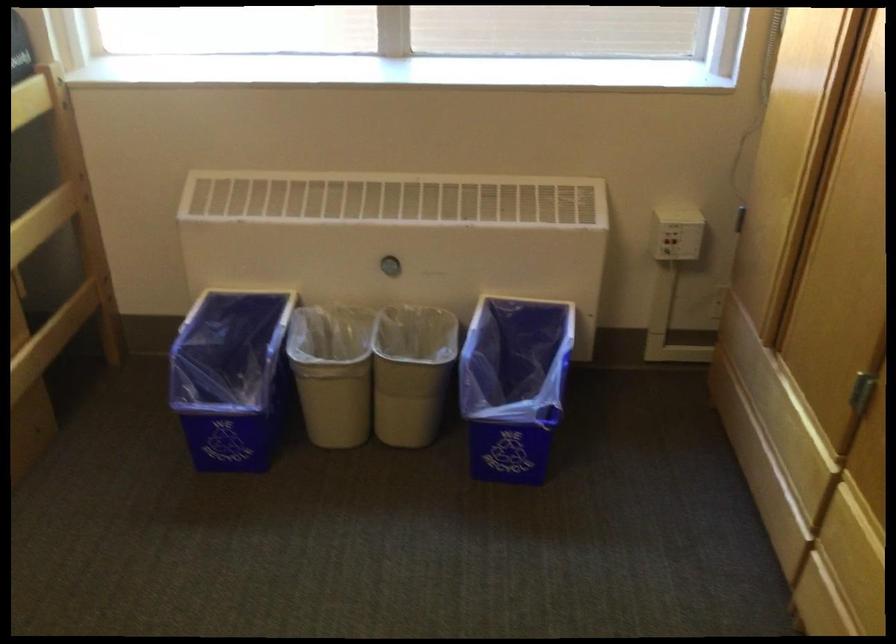
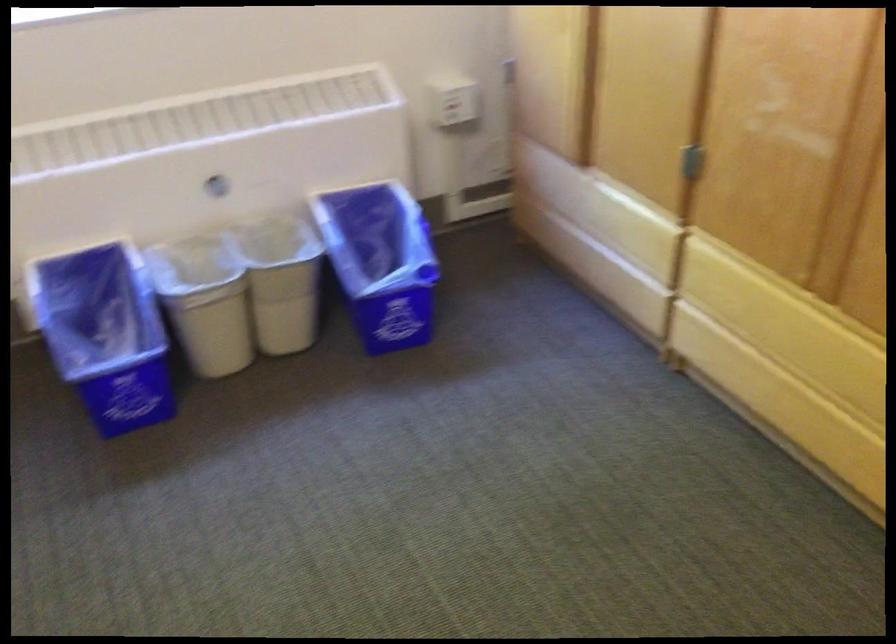
The point at (x=250, y=372) is marked in the first image. Where is the corresponding point in the second image?

(105, 334)